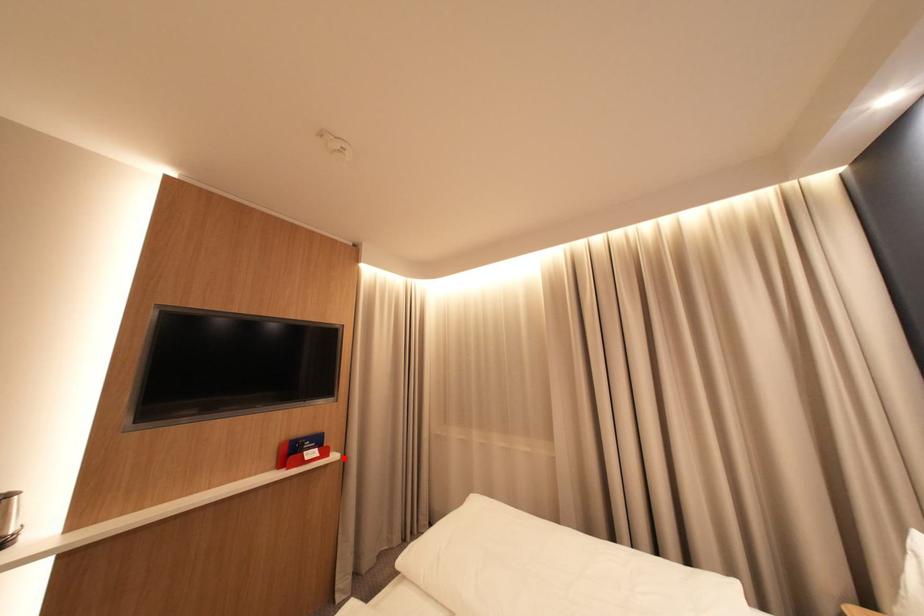
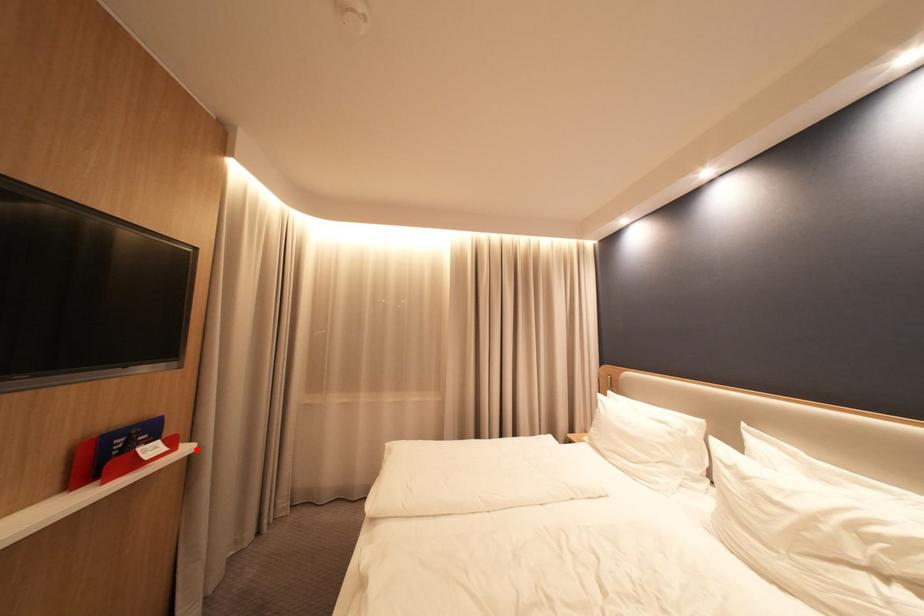
I am providing you with two images of the same scene from different viewpoints. A red point is marked on the first image and another point is marked on the second image. Does the point marked in image1 correspond to the same location as the one in image2?

Yes